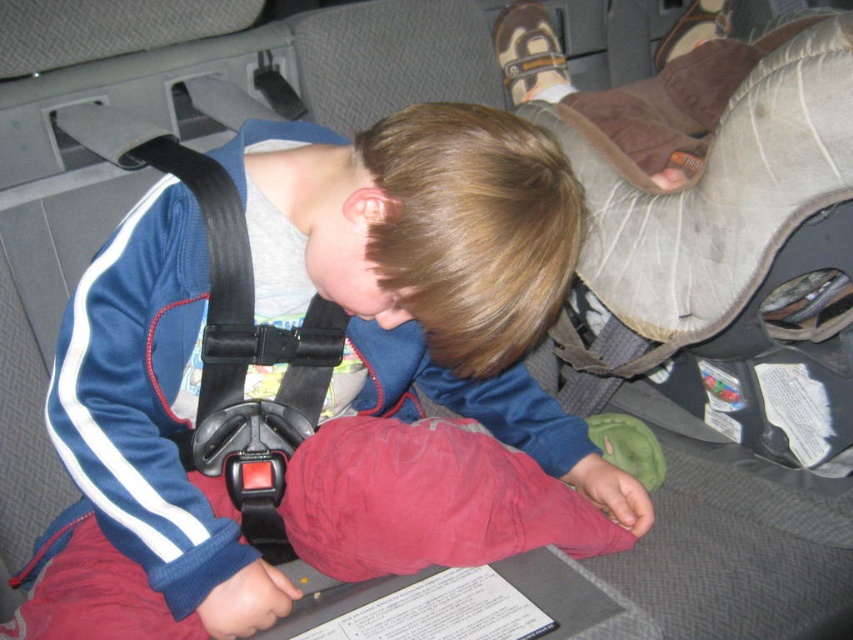
Who is lower down, matte blue jacket at center or black plastic seatbelt at center?

matte blue jacket at center is below.

Is matte blue jacket at center positioned behind black plastic seatbelt at center?

No, it is not.

At what (x,y) coordinates should I click in order to perform the action: click on matte blue jacket at center. Please return your answer as a coordinate pair (x, y). The width and height of the screenshot is (853, 640). Looking at the image, I should click on (322, 378).

Where is `matte blue jacket at center`? matte blue jacket at center is located at coordinates (322, 378).